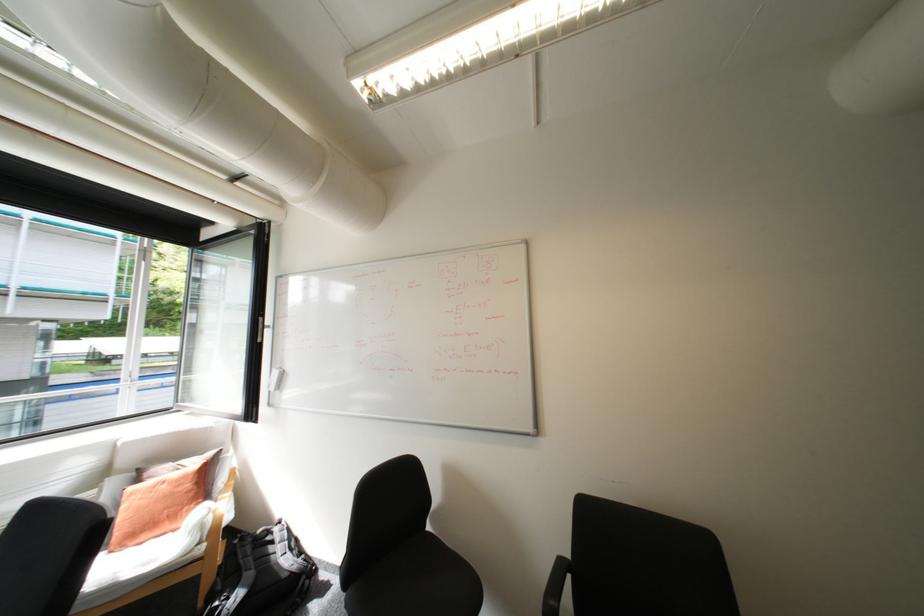
Locate an element on the screen. Image resolution: width=924 pixels, height=616 pixels. black chair armrest is located at coordinates (554, 592).